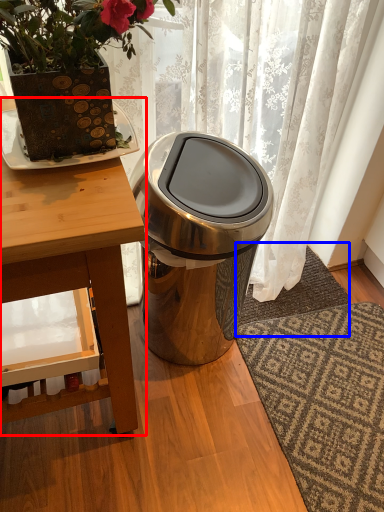
Question: Which object is further to the camera taking this photo, table (highlighted by a red box) or doormat (highlighted by a blue box)?

Choices:
 (A) table
 (B) doormat

Answer: (B)